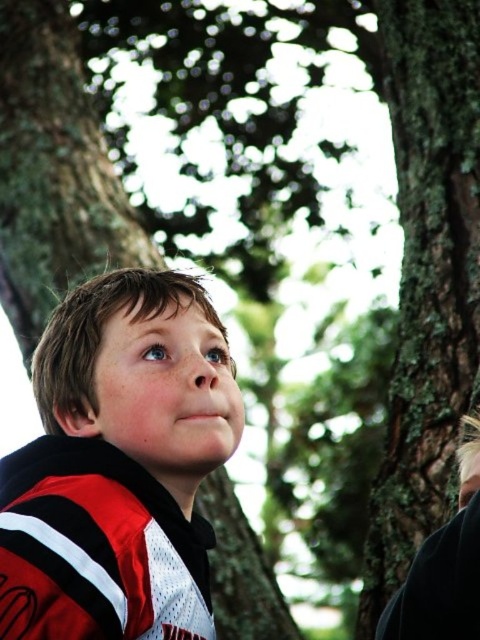
The image size is (480, 640). What do you see at coordinates (119, 465) in the screenshot?
I see `red and white jersey at center` at bounding box center [119, 465].

Is point (57, 602) positioned behind point (422, 38)?

No, (57, 602) is in front of (422, 38).

Who is more distant from viewer, (9, 598) or (459, 188)?

The point (459, 188) is more distant.

I want to click on red and white jersey at center, so click(x=119, y=465).